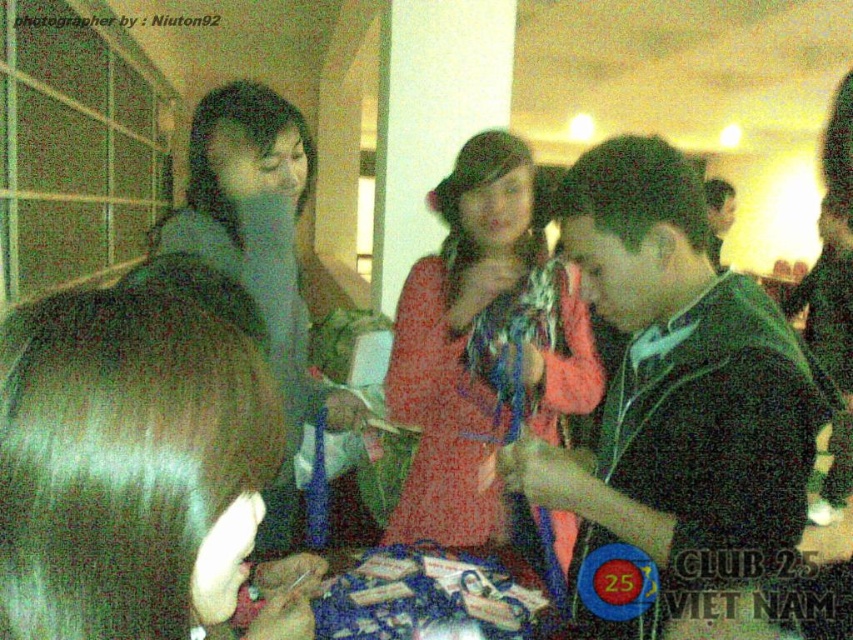
Question: Which of the following is the closest to the observer?

Choices:
 (A) matte red dress at center
 (B) matte gray hoodie at center

Answer: (B)

Question: Among these objects, which one is farthest from the camera?

Choices:
 (A) matte red dress at center
 (B) brown shiny hair at center

Answer: (A)

Question: Among these objects, which one is farthest from the camera?

Choices:
 (A) matte red dress at center
 (B) brown shiny hair at center
 (C) matte gray hoodie at center

Answer: (A)

Question: Is the position of brown shiny hair at center more distant than that of matte red dress at center?

Choices:
 (A) no
 (B) yes

Answer: (A)

Question: Is matte red dress at center below matte gray hoodie at center?

Choices:
 (A) yes
 (B) no

Answer: (B)

Question: Does matte red dress at center have a smaller size compared to matte gray hoodie at center?

Choices:
 (A) no
 (B) yes

Answer: (B)